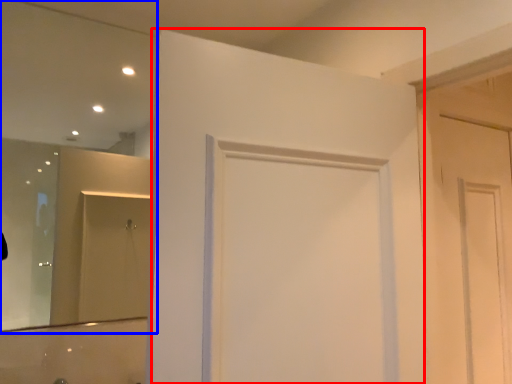
Question: Which point is closer to the camera, door (highlighted by a red box) or mirror (highlighted by a blue box)?

Choices:
 (A) door
 (B) mirror

Answer: (A)